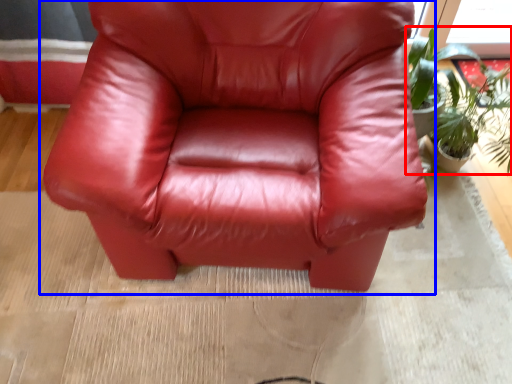
Question: Which of the following is the closest to the observer, houseplant (highlighted by a red box) or chair (highlighted by a blue box)?

Choices:
 (A) houseplant
 (B) chair

Answer: (B)